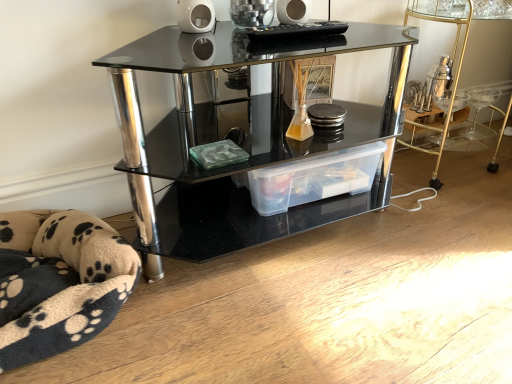
Question: Is clear plastic storage container at lower right positioned behind transparent plastic storage box at center?

Choices:
 (A) yes
 (B) no

Answer: (A)

Question: Could you tell me if clear plastic storage container at lower right is turned towards transparent plastic storage box at center?

Choices:
 (A) no
 (B) yes

Answer: (A)

Question: Can you confirm if clear plastic storage container at lower right is positioned to the right of transparent plastic storage box at center?

Choices:
 (A) yes
 (B) no

Answer: (A)

Question: Would you consider clear plastic storage container at lower right to be distant from transparent plastic storage box at center?

Choices:
 (A) no
 (B) yes

Answer: (A)

Question: Considering the relative sizes of clear plastic storage container at lower right and transparent plastic storage box at center in the image provided, is clear plastic storage container at lower right taller than transparent plastic storage box at center?

Choices:
 (A) no
 (B) yes

Answer: (B)

Question: Is clear plastic storage container at lower right wider than transparent plastic storage box at center?

Choices:
 (A) no
 (B) yes

Answer: (B)

Question: Considering the relative sizes of black glass shelf at center and transparent plastic storage box at center in the image provided, is black glass shelf at center bigger than transparent plastic storage box at center?

Choices:
 (A) yes
 (B) no

Answer: (A)

Question: Does black glass shelf at center have a greater width compared to transparent plastic storage box at center?

Choices:
 (A) no
 (B) yes

Answer: (B)

Question: Considering the relative positions of black glass shelf at center and transparent plastic storage box at center in the image provided, is black glass shelf at center to the right of transparent plastic storage box at center from the viewer's perspective?

Choices:
 (A) yes
 (B) no

Answer: (B)

Question: Considering the relative sizes of black glass shelf at center and transparent plastic storage box at center in the image provided, is black glass shelf at center thinner than transparent plastic storage box at center?

Choices:
 (A) yes
 (B) no

Answer: (B)

Question: Can you confirm if black glass shelf at center is positioned to the left of transparent plastic storage box at center?

Choices:
 (A) yes
 (B) no

Answer: (A)

Question: Can you confirm if black glass shelf at center is smaller than transparent plastic storage box at center?

Choices:
 (A) yes
 (B) no

Answer: (B)

Question: Does transparent plastic storage box at center have a lesser width compared to clear plastic storage container at lower right?

Choices:
 (A) no
 (B) yes

Answer: (B)